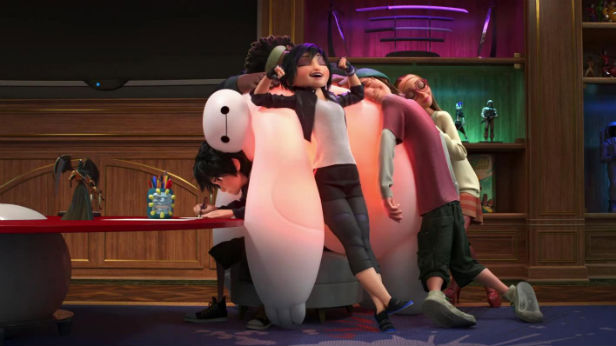
Where is `window`? window is located at coordinates (602, 182).